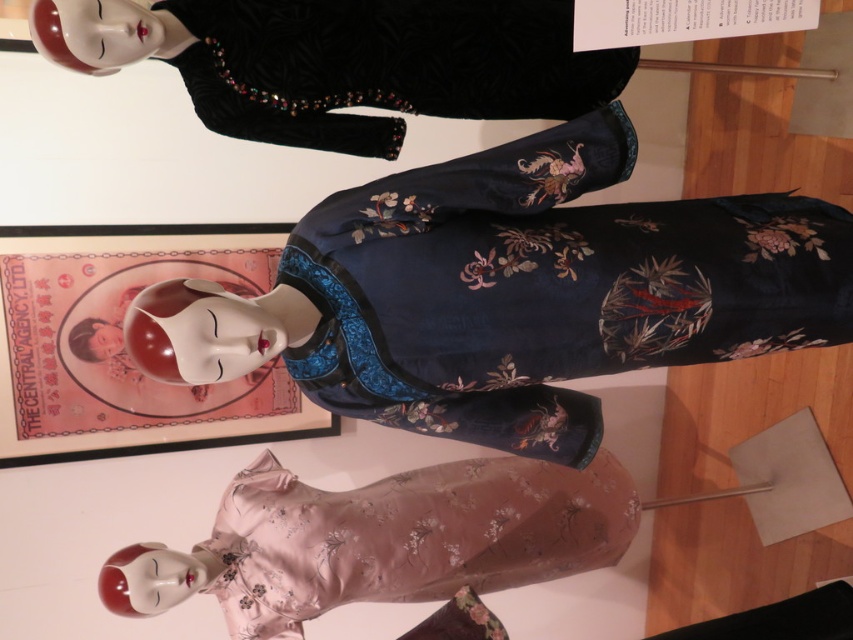
Question: Which of these objects is positioned closest to the velvet black dress at upper center?

Choices:
 (A) pale pink satin dress at lower center
 (B) navy satin dress at center

Answer: (B)

Question: Can you confirm if navy satin dress at center is positioned to the left of pale pink satin dress at lower center?

Choices:
 (A) no
 (B) yes

Answer: (A)

Question: Among these objects, which one is nearest to the camera?

Choices:
 (A) velvet black dress at upper center
 (B) pale pink satin dress at lower center
 (C) navy satin dress at center

Answer: (C)

Question: Does navy satin dress at center have a lesser width compared to pale pink satin dress at lower center?

Choices:
 (A) no
 (B) yes

Answer: (A)

Question: Which of these objects is positioned farthest from the velvet black dress at upper center?

Choices:
 (A) navy satin dress at center
 (B) pale pink satin dress at lower center

Answer: (B)

Question: Can you confirm if velvet black dress at upper center is positioned to the left of pale pink satin dress at lower center?

Choices:
 (A) yes
 (B) no

Answer: (A)